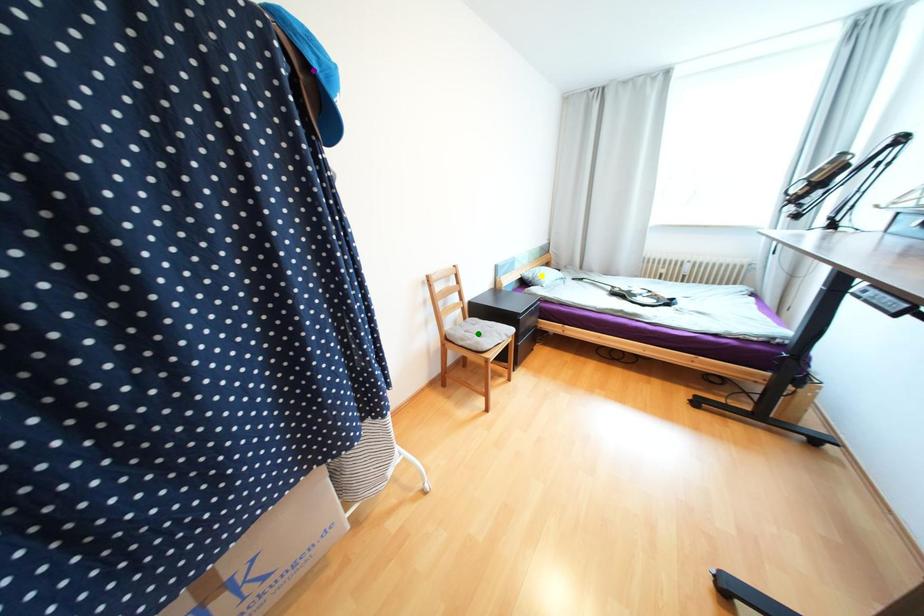
Order these from farthest to nearest:
- yellow point
- purple point
- green point

yellow point, green point, purple point